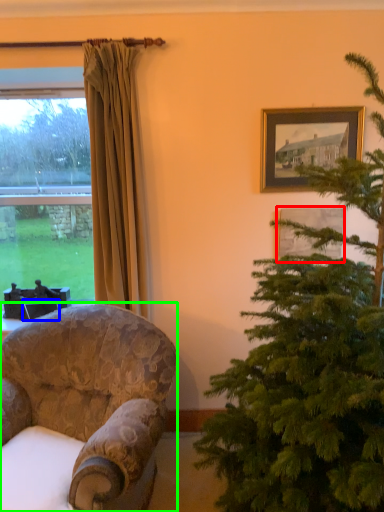
Question: Which is farther away from picture frame (highlighted by a red box)? picture frame (highlighted by a blue box) or chair (highlighted by a green box)?

Choices:
 (A) picture frame
 (B) chair

Answer: (A)